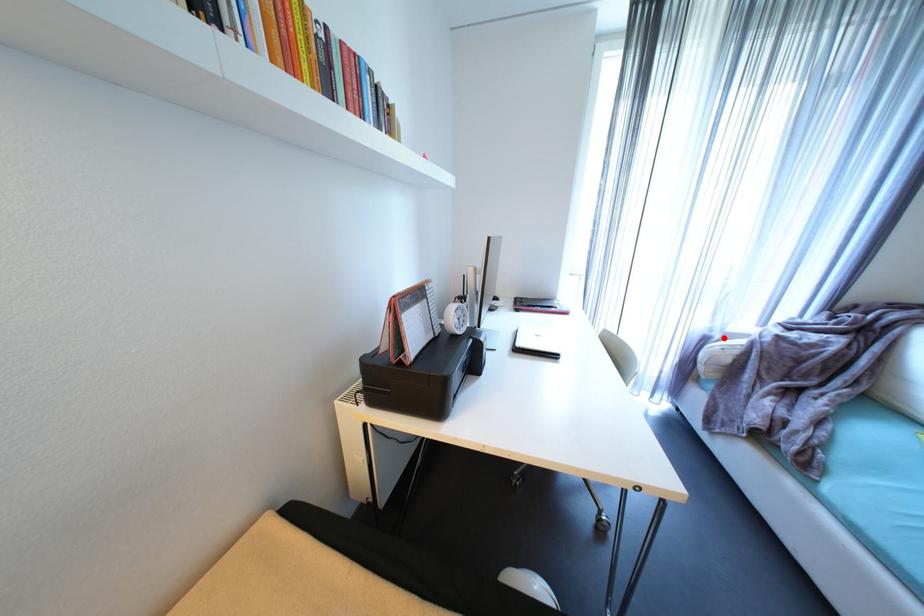
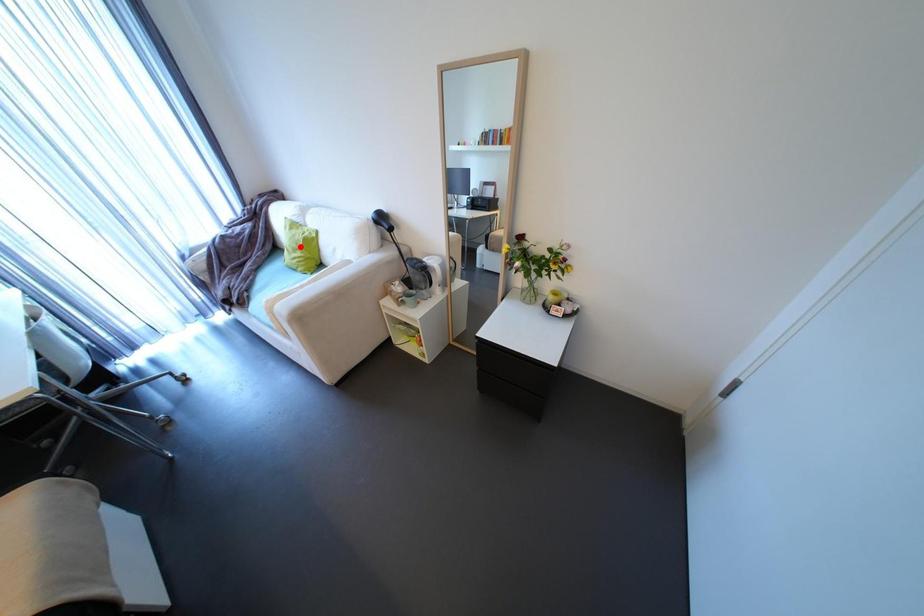
I am providing you with two images of the same scene from different viewpoints. A red point is marked on the first image and another point is marked on the second image. Does the point marked in image1 correspond to the same location as the one in image2?

No